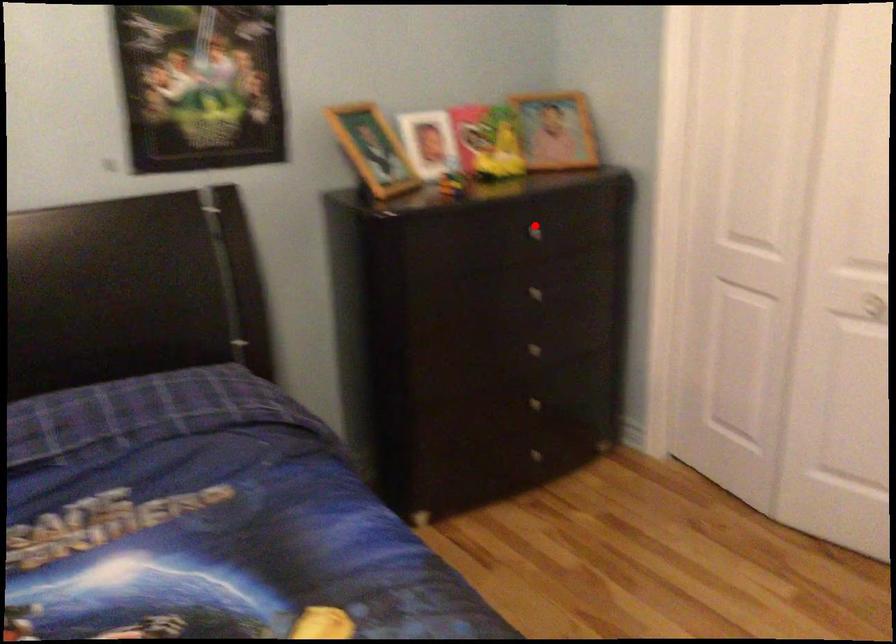
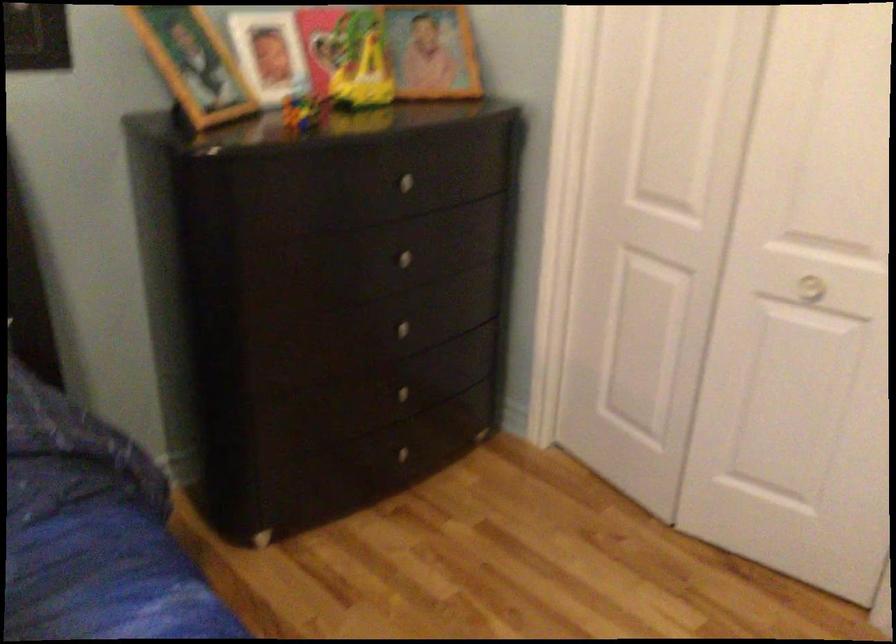
Locate, in the second image, the point that corresponds to the highlighted location in the first image.

(408, 178)